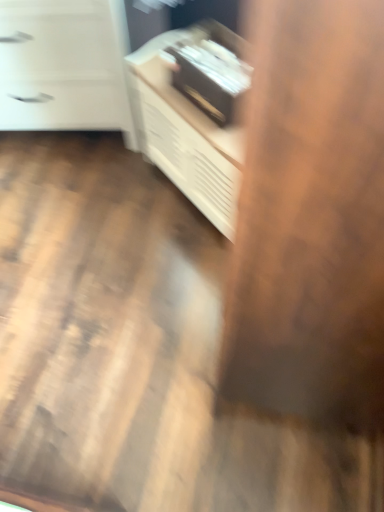
The image size is (384, 512). What do you see at coordinates (196, 113) in the screenshot?
I see `white wood cabinet at upper center` at bounding box center [196, 113].

What are the coordinates of `white wood cabinet at upper center` in the screenshot? It's located at (196, 113).

What do you see at coordinates (64, 66) in the screenshot? The width and height of the screenshot is (384, 512). I see `white matte chest of drawers at upper left` at bounding box center [64, 66].

Where is `white matte chest of drawers at upper left`? Image resolution: width=384 pixels, height=512 pixels. white matte chest of drawers at upper left is located at coordinates (64, 66).

Image resolution: width=384 pixels, height=512 pixels. In order to click on white wood cabinet at upper center in this screenshot , I will do `click(196, 113)`.

Considering the relative positions of white matte chest of drawers at upper left and white wood cabinet at upper center in the image provided, is white matte chest of drawers at upper left to the right of white wood cabinet at upper center from the viewer's perspective?

Incorrect, white matte chest of drawers at upper left is not on the right side of white wood cabinet at upper center.

Between white matte chest of drawers at upper left and white wood cabinet at upper center, which one is positioned behind?

white matte chest of drawers at upper left is behind.

Does point (41, 76) lie behind point (220, 167)?

Yes.

From the image's perspective, which one is positioned lower, white matte chest of drawers at upper left or white wood cabinet at upper center?

From the image's view, white wood cabinet at upper center is below.

From a real-world perspective, is white matte chest of drawers at upper left above or below white wood cabinet at upper center?

From a real-world perspective, white matte chest of drawers at upper left is physically above white wood cabinet at upper center.

Which of these two, white matte chest of drawers at upper left or white wood cabinet at upper center, is wider?

white matte chest of drawers at upper left is wider.

Does white matte chest of drawers at upper left have a lesser height compared to white wood cabinet at upper center?

Incorrect, the height of white matte chest of drawers at upper left does not fall short of that of white wood cabinet at upper center.

Considering the sizes of objects white matte chest of drawers at upper left and white wood cabinet at upper center in the image provided, who is bigger, white matte chest of drawers at upper left or white wood cabinet at upper center?

Bigger between the two is white matte chest of drawers at upper left.

Is white matte chest of drawers at upper left positioned beyond the bounds of white wood cabinet at upper center?

Yes, white matte chest of drawers at upper left is outside of white wood cabinet at upper center.

Is white matte chest of drawers at upper left far away from white wood cabinet at upper center?

white matte chest of drawers at upper left is actually quite close to white wood cabinet at upper center.

Is white wood cabinet at upper center at the back of white matte chest of drawers at upper left?

No, white matte chest of drawers at upper left is not facing away from white wood cabinet at upper center.

How many degrees apart are the facing directions of white matte chest of drawers at upper left and white wood cabinet at upper center?

The angle between the facing direction of white matte chest of drawers at upper left and the facing direction of white wood cabinet at upper center is 52.9 degrees.

Based on the photo, measure the distance from white matte chest of drawers at upper left to white wood cabinet at upper center.

30.34 centimeters.

Identify the location of the chest of drawers located above the white wood cabinet at upper center (from the image's perspective). Image resolution: width=384 pixels, height=512 pixels. (64, 66).

Can you confirm if white wood cabinet at upper center is positioned to the left of white matte chest of drawers at upper left?

No.

Is white wood cabinet at upper center further to camera compared to white matte chest of drawers at upper left?

No, white wood cabinet at upper center is closer to the viewer.

Which is behind, point (209, 202) or point (15, 82)?

The point (15, 82) is behind.

From the image's perspective, is white wood cabinet at upper center over white matte chest of drawers at upper left?

Actually, white wood cabinet at upper center appears below white matte chest of drawers at upper left in the image.

From a real-world perspective, between white wood cabinet at upper center and white matte chest of drawers at upper left, who is vertically higher?

white matte chest of drawers at upper left, from a real-world perspective.

Considering the sizes of objects white wood cabinet at upper center and white matte chest of drawers at upper left in the image provided, who is thinner, white wood cabinet at upper center or white matte chest of drawers at upper left?

white wood cabinet at upper center.

Can you confirm if white wood cabinet at upper center is taller than white matte chest of drawers at upper left?

No, white wood cabinet at upper center is not taller than white matte chest of drawers at upper left.

Consider the image. Who is smaller, white wood cabinet at upper center or white matte chest of drawers at upper left?

white wood cabinet at upper center is smaller.

Would you say white wood cabinet at upper center is inside or outside white matte chest of drawers at upper left?

white wood cabinet at upper center is not inside white matte chest of drawers at upper left, it's outside.

Is white wood cabinet at upper center positioned far away from white matte chest of drawers at upper left?

No, white wood cabinet at upper center is not far away from white matte chest of drawers at upper left.

Could you tell me if white wood cabinet at upper center is turned towards white matte chest of drawers at upper left?

No.

How far apart are white wood cabinet at upper center and white matte chest of drawers at upper left?

The distance of white wood cabinet at upper center from white matte chest of drawers at upper left is 11.94 inches.

You are a GUI agent. You are given a task and a screenshot of the screen. Output one action in this format:
    pyautogui.click(x=<x>, y=<y>)
    Task: Click on the furniture that appears below the white matte chest of drawers at upper left (from a real-world perspective)
    The height and width of the screenshot is (512, 384).
    Given the screenshot: What is the action you would take?
    pyautogui.click(x=196, y=113)

The width and height of the screenshot is (384, 512). Identify the location of chest of drawers above the white wood cabinet at upper center (from a real-world perspective). (64, 66).

Find the location of a particular element. furniture that appears below the white matte chest of drawers at upper left (from a real-world perspective) is located at coordinates point(196,113).